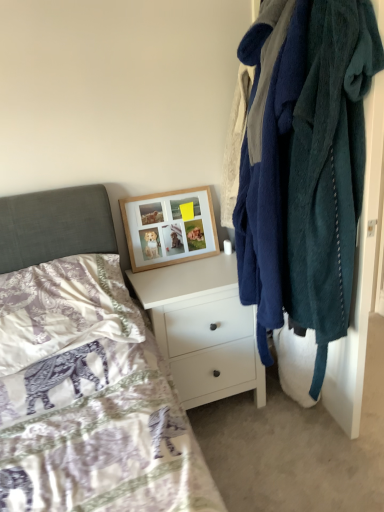
This screenshot has height=512, width=384. What are the coordinates of `white matte chest of drawers at center` in the screenshot? It's located at (203, 328).

You are a GUI agent. You are given a task and a screenshot of the screen. Output one action in this format:
    pyautogui.click(x=<x>, y=<y>)
    Task: Click on the white matte chest of drawers at center
    This screenshot has height=512, width=384.
    Given the screenshot: What is the action you would take?
    pyautogui.click(x=203, y=328)

How different are the orientations of white matte chest of drawers at center and teal fuzzy robe at right in degrees?

There is a 94.1-degree angle between the facing directions of white matte chest of drawers at center and teal fuzzy robe at right.

From the image's perspective, between white matte chest of drawers at center and teal fuzzy robe at right, who is located below?

From the image's view, white matte chest of drawers at center is below.

Does point (152, 278) lie in front of point (324, 106)?

No.

Based on the photo, could teal fuzzy robe at right be considered to be inside white matte chest of drawers at center?

No.

Can you tell me how much purple satin pillow at lower left and woodenobject at upper center differ in facing direction?

1.46 degrees separate the facing orientations of purple satin pillow at lower left and woodenobject at upper center.

Between purple satin pillow at lower left and woodenobject at upper center, which one is positioned behind?

woodenobject at upper center.

In the scene shown: Is purple satin pillow at lower left not close to woodenobject at upper center?

Actually, purple satin pillow at lower left and woodenobject at upper center are a little close together.

Between purple satin pillow at lower left and teal fuzzy robe at right, which one has smaller size?

With smaller size is purple satin pillow at lower left.

Which of these two, purple satin pillow at lower left or teal fuzzy robe at right, stands taller?

teal fuzzy robe at right.

Looking at this image, does purple satin pillow at lower left turn towards teal fuzzy robe at right?

No, purple satin pillow at lower left is not oriented towards teal fuzzy robe at right.

Is purple satin pillow at lower left inside the boundaries of teal fuzzy robe at right, or outside?

purple satin pillow at lower left is not inside teal fuzzy robe at right, it's outside.

The height and width of the screenshot is (512, 384). I want to click on picture frame behind the teal fuzzy robe at right, so click(x=169, y=228).

Is woodenobject at upper center surrounded by teal fuzzy robe at right?

No, teal fuzzy robe at right does not contain woodenobject at upper center.

Looking at this image, is teal fuzzy robe at right facing away from woodenobject at upper center?

No, teal fuzzy robe at right is not facing the opposite direction of woodenobject at upper center.

Can purple satin pillow at lower left be found inside woodenobject at upper center?

No, purple satin pillow at lower left is located outside of woodenobject at upper center.

From a real-world perspective, is woodenobject at upper center physically above purple satin pillow at lower left?

Indeed, from a real-world perspective, woodenobject at upper center stands above purple satin pillow at lower left.

Which object is further away from the camera, white matte chest of drawers at center or woodenobject at upper center?

woodenobject at upper center is further from the camera.

Based on the photo, is white matte chest of drawers at center taller or shorter than woodenobject at upper center?

Considering their sizes, white matte chest of drawers at center has more height than woodenobject at upper center.

Considering the relative positions of white matte chest of drawers at center and woodenobject at upper center in the image provided, is white matte chest of drawers at center to the left or to the right of woodenobject at upper center?

In the image, white matte chest of drawers at center appears on the right side of woodenobject at upper center.

From the image's perspective, is purple satin pillow at lower left over white matte chest of drawers at center?

Yes, from the image's perspective, purple satin pillow at lower left is on top of white matte chest of drawers at center.

Relative to white matte chest of drawers at center, is purple satin pillow at lower left in front or behind?

purple satin pillow at lower left is positioned closer to the viewer than white matte chest of drawers at center.

Considering the sizes of objects purple satin pillow at lower left and white matte chest of drawers at center in the image provided, who is smaller, purple satin pillow at lower left or white matte chest of drawers at center?

Smaller between the two is purple satin pillow at lower left.

Is purple satin pillow at lower left completely or partially outside of white matte chest of drawers at center?

Yes, purple satin pillow at lower left is outside of white matte chest of drawers at center.

Where is `closet above the white matte chest of drawers at center (from the image's perspective)`? closet above the white matte chest of drawers at center (from the image's perspective) is located at coordinates (305, 165).

Image resolution: width=384 pixels, height=512 pixels. In order to click on picture frame behind the purple satin pillow at lower left in this screenshot , I will do `click(169, 228)`.

Considering their positions, is white matte chest of drawers at center positioned further to woodenobject at upper center than teal fuzzy robe at right?

Based on the image, teal fuzzy robe at right appears to be further to woodenobject at upper center.

Which object lies further to the anchor point teal fuzzy robe at right, white matte chest of drawers at center or woodenobject at upper center?

The object further to teal fuzzy robe at right is woodenobject at upper center.

Based on their spatial positions, is teal fuzzy robe at right or woodenobject at upper center further from white matte chest of drawers at center?

teal fuzzy robe at right is positioned further to the anchor white matte chest of drawers at center.

When comparing their distances from purple satin pillow at lower left, does teal fuzzy robe at right or woodenobject at upper center seem closer?

woodenobject at upper center lies closer to purple satin pillow at lower left than the other object.

Based on their spatial positions, is teal fuzzy robe at right or white matte chest of drawers at center closer to purple satin pillow at lower left?

Among the two, white matte chest of drawers at center is located nearer to purple satin pillow at lower left.

Consider the image. When comparing their distances from white matte chest of drawers at center, does woodenobject at upper center or teal fuzzy robe at right seem closer?

Among the two, woodenobject at upper center is located nearer to white matte chest of drawers at center.

Which object lies further to the anchor point woodenobject at upper center, purple satin pillow at lower left or white matte chest of drawers at center?

Based on the image, purple satin pillow at lower left appears to be further to woodenobject at upper center.

From the image, which object appears to be nearer to white matte chest of drawers at center, woodenobject at upper center or purple satin pillow at lower left?

Based on the image, woodenobject at upper center appears to be nearer to white matte chest of drawers at center.

Where is `chest of drawers between purple satin pillow at lower left and teal fuzzy robe at right from left to right`? chest of drawers between purple satin pillow at lower left and teal fuzzy robe at right from left to right is located at coordinates (203, 328).

I want to click on chest of drawers between purple satin pillow at lower left and woodenobject at upper center in the front-back direction, so click(x=203, y=328).

Identify the location of chest of drawers between teal fuzzy robe at right and woodenobject at upper center from front to back. This screenshot has width=384, height=512. (203, 328).

Where is `picture frame between purple satin pillow at lower left and teal fuzzy robe at right in the horizontal direction`? This screenshot has width=384, height=512. picture frame between purple satin pillow at lower left and teal fuzzy robe at right in the horizontal direction is located at coordinates (169, 228).